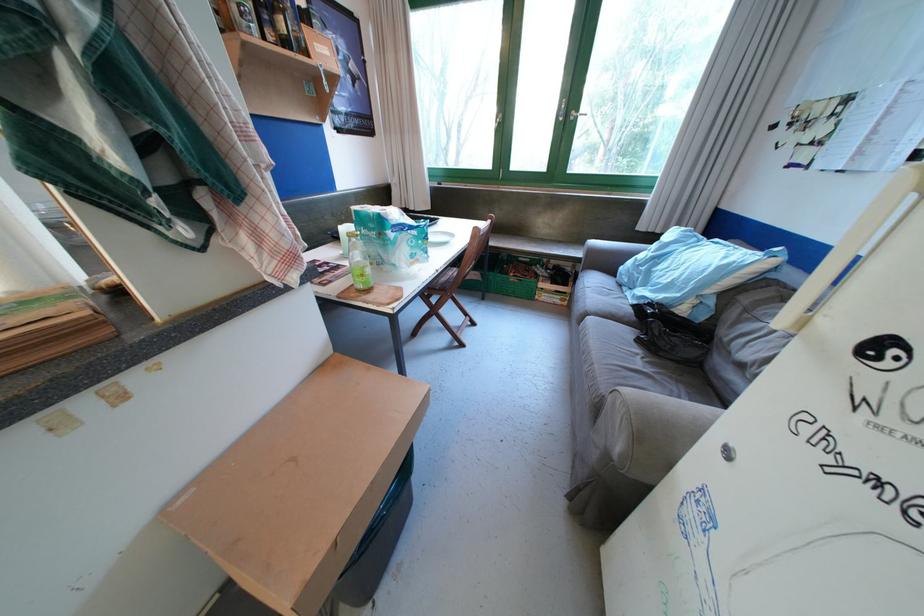
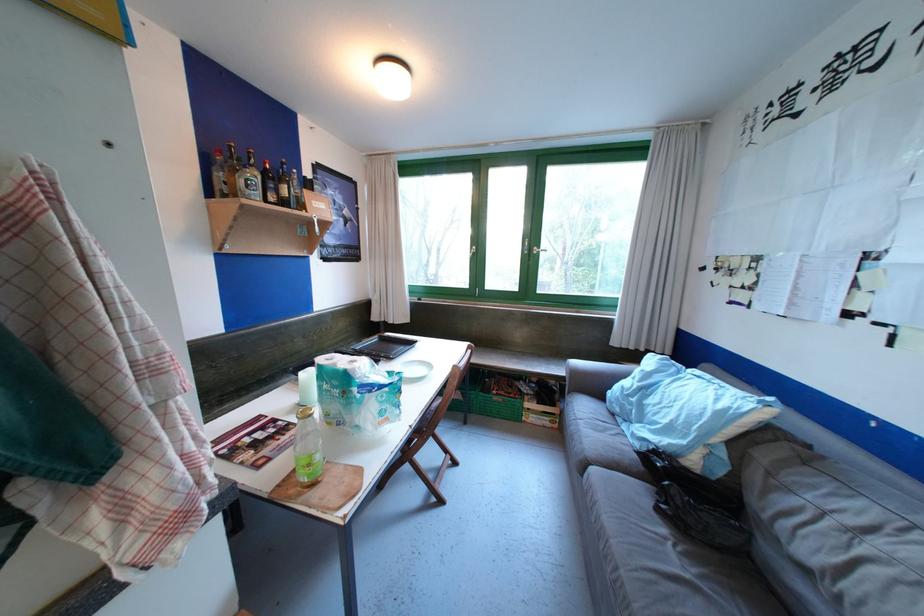
Find the pixel in the second image that matches the point at 527,277 in the first image.

(509, 394)